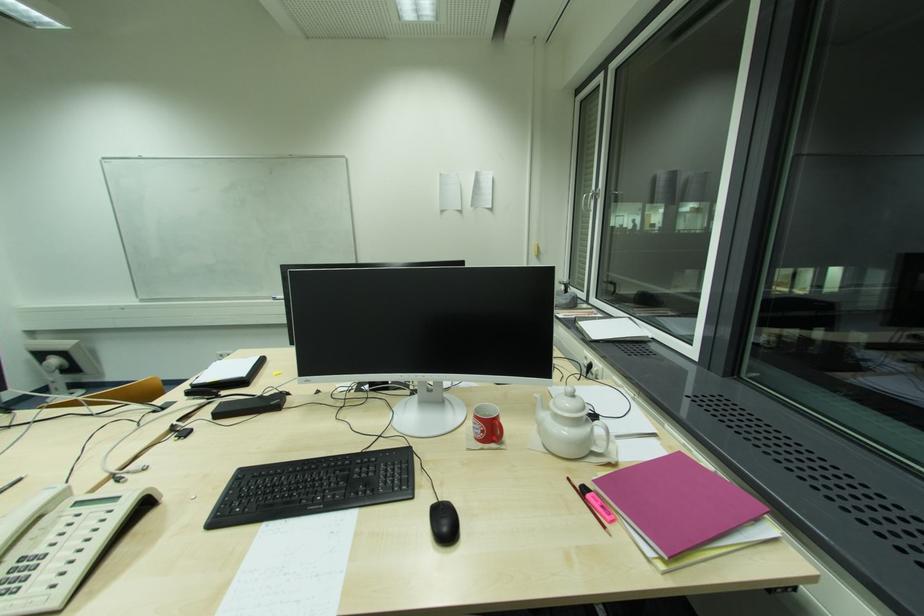
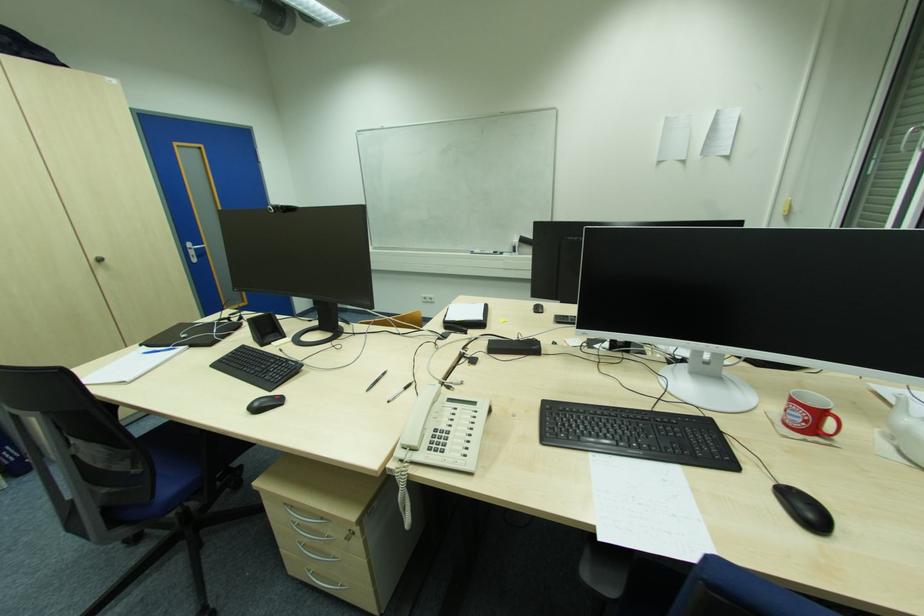
Question: What movement of the cameraman would produce the second image?

Choices:
 (A) Left
 (B) Right
 (C) Forward
 (D) Backward

Answer: (A)